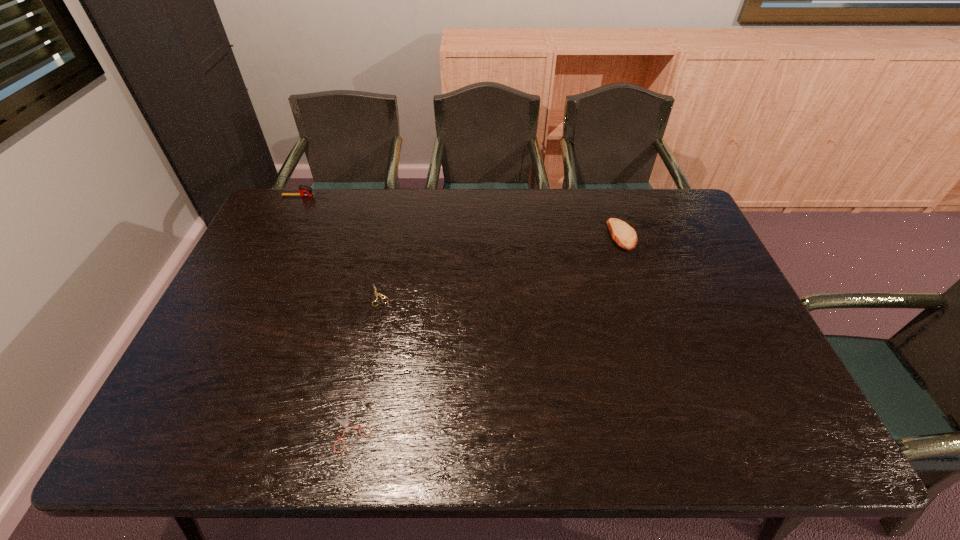
Identify the location of vacant area that lies between the nearest object and the farther shears. This screenshot has width=960, height=540. (366, 363).

Identify the location of object that is the nearest to the nearer shears. The image size is (960, 540). (380, 295).

Identify the location of object that is the closest to the second farthest object. (380, 295).

I want to click on free location that satisfies the following two spatial constraints: 1. on the back side of the pita bread; 2. on the right side of the second nearest object, so click(x=393, y=235).

Locate an element on the screen. The width and height of the screenshot is (960, 540). vacant area in the image that satisfies the following two spatial constraints: 1. on the front side of the shortest object; 2. on the left side of the farthest object is located at coordinates (196, 431).

Find the location of `vacant space that satisfies the following two spatial constraints: 1. on the front side of the nearest object; 2. on the right side of the farthest object`. vacant space that satisfies the following two spatial constraints: 1. on the front side of the nearest object; 2. on the right side of the farthest object is located at coordinates (196, 431).